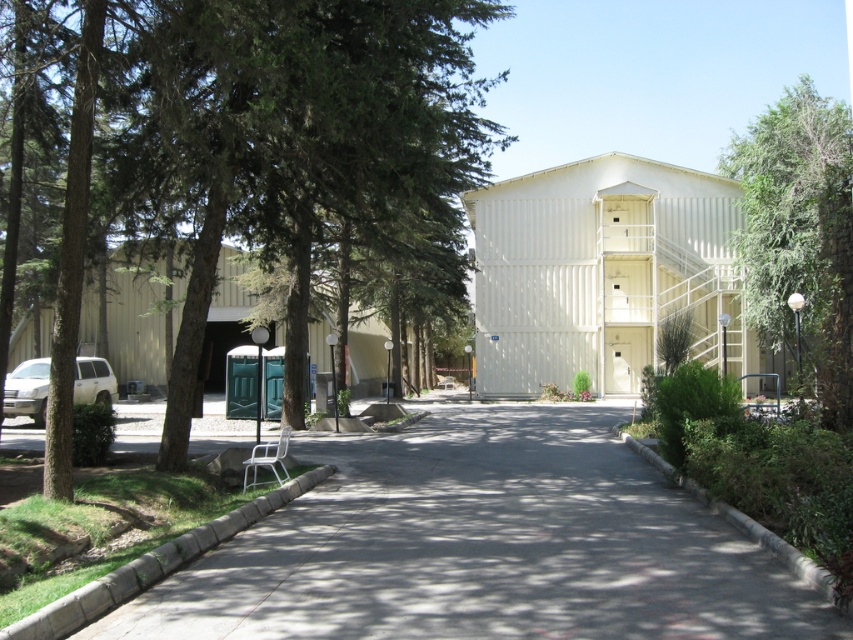
You are a delivery person trying to park your matte white suv at left in a spot near the gray asphalt pavement at center. Considering their sizes, will the SUV fit entirely on the pavement?

The gray asphalt pavement at center is shorter than the matte white suv at left, so the SUV will not fit entirely on the pavement.

You are standing at the entrance of the building and want to locate the green leafy tree at upper right. According to the coordinates provided, where should you look relative to your position?

The green leafy tree at upper right is located at point 0.366 on the x axis and 0.939 on the y axis, so you should look towards the upper right direction relative to your position at the entrance.

You are a delivery person carrying a heavy box and need to walk from the gray asphalt pavement at center to the green leafy tree at center. Is there enough space between them for you to pass through comfortably?

The gray asphalt pavement at center and green leafy tree at center are 26.28 feet apart from each other, so yes, there is enough space between them for you to pass through comfortably.